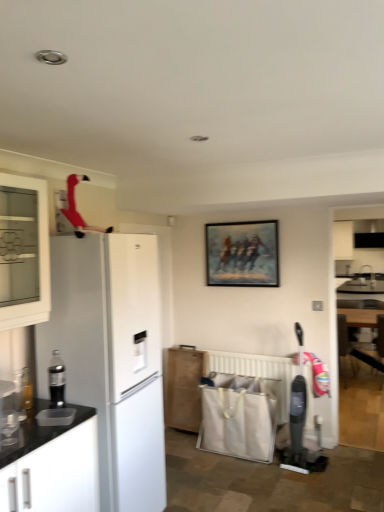
At what (x,y) coordinates should I click in order to perform the action: click on vacant region above oil painting at center (from a real-world perspective). Please return your answer as a coordinate pair (x, y). Looking at the image, I should click on (236, 218).